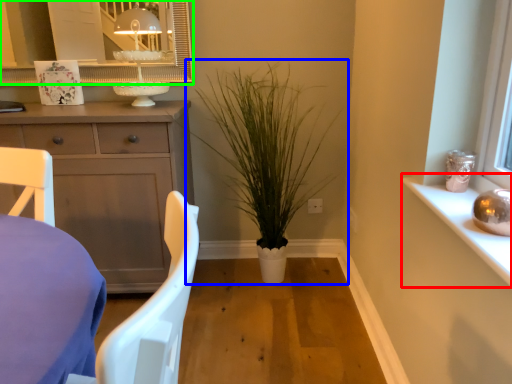
Question: Based on their relative distances, which object is nearer to window sill (highlighted by a red box)? Choose from houseplant (highlighted by a blue box) and mirror (highlighted by a green box).

Choices:
 (A) houseplant
 (B) mirror

Answer: (A)